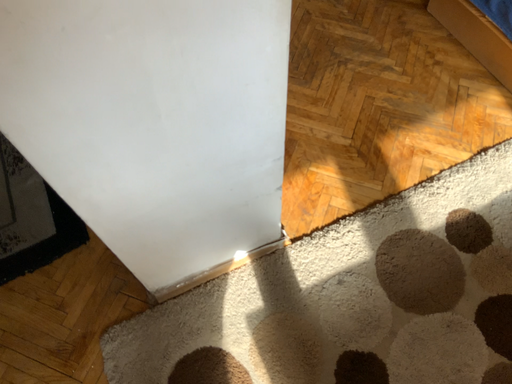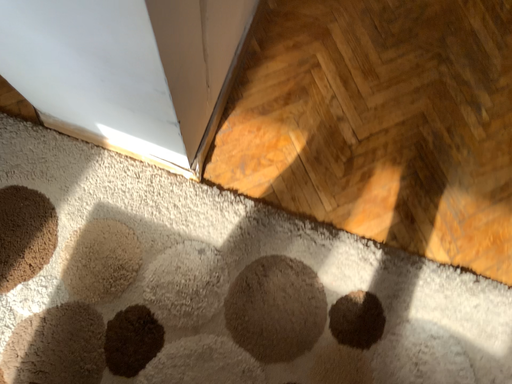
Question: How did the camera likely rotate when shooting the video?

Choices:
 (A) rotated upward
 (B) rotated downward

Answer: (B)